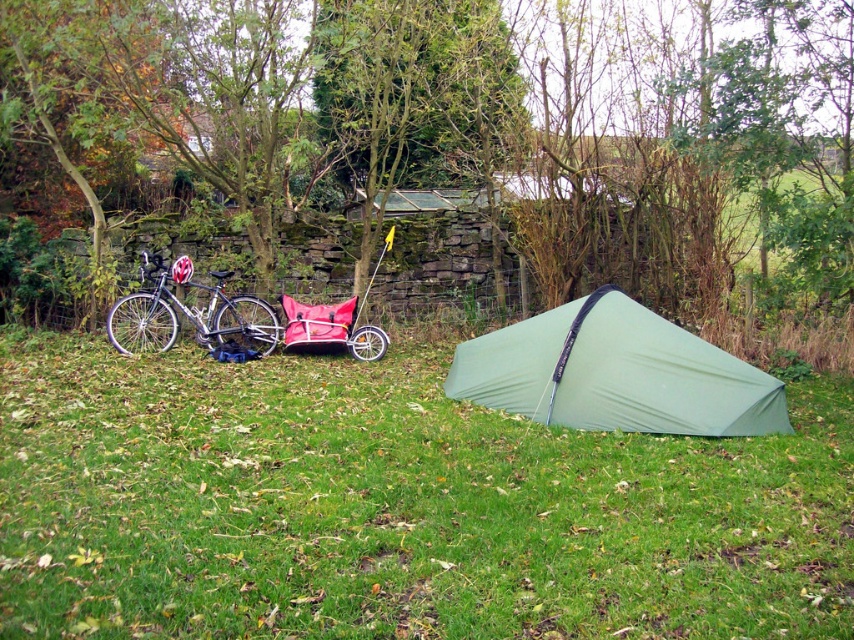
Question: Where is green grassy at center located in relation to shiny silver bicycle at left in the image?

Choices:
 (A) right
 (B) left

Answer: (A)

Question: Can you confirm if green grassy at center is positioned to the right of green fabric tent at center?

Choices:
 (A) no
 (B) yes

Answer: (B)

Question: Does green grassy at center have a lesser width compared to red fabric baby carriage at center?

Choices:
 (A) no
 (B) yes

Answer: (B)

Question: Estimate the real-world distances between objects in this image. Which object is farther from the green fabric tent at center?

Choices:
 (A) shiny silver bicycle at left
 (B) green grassy at center

Answer: (A)

Question: Based on their relative distances, which object is farther from the shiny silver bicycle at left?

Choices:
 (A) red fabric baby carriage at center
 (B) green grassy at center

Answer: (B)

Question: Which point is farther from the camera taking this photo?

Choices:
 (A) (354, 296)
 (B) (22, 333)
 (C) (658, 426)
 (D) (186, 264)

Answer: (A)